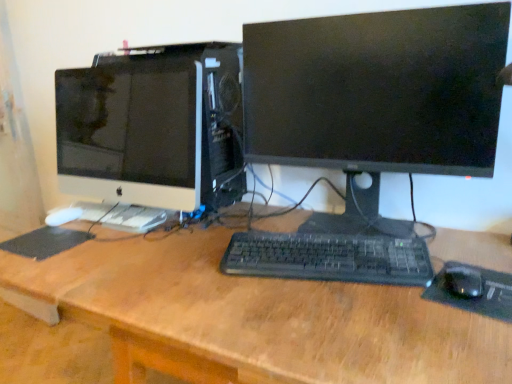
Locate an element on the screen. This screenshot has width=512, height=384. free space behind black plastic keyboard at center is located at coordinates (291, 217).